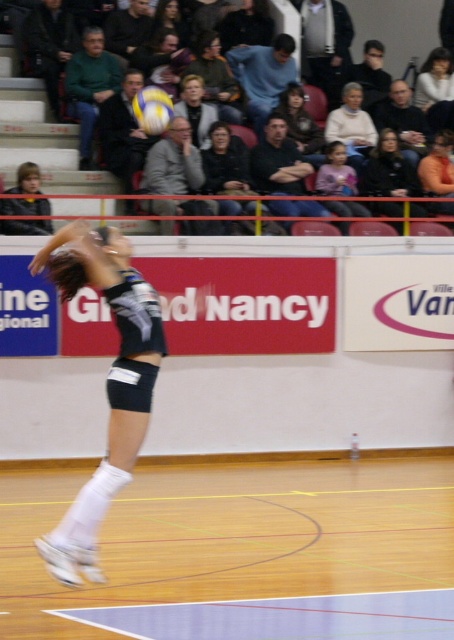
Question: Based on their relative distances, which object is nearer to the white matte volleyball at center?

Choices:
 (A) black jersey at upper center
 (B) smooth white blouse at upper center
 (C) orange fabric shirt at upper right

Answer: (A)

Question: Which object is the closest to the orange fabric shirt at upper right?

Choices:
 (A) wooden floor at center
 (B) smooth white blouse at upper center

Answer: (B)

Question: Does pink fabric shirt at center come behind smooth white blouse at upper center?

Choices:
 (A) yes
 (B) no

Answer: (B)

Question: Which point is closer to the camera?

Choices:
 (A) (343, 497)
 (B) (350, 177)
 (C) (144, 92)

Answer: (C)

Question: Does dark brown hair at upper center appear on the left side of matte black shorts at center?

Choices:
 (A) no
 (B) yes

Answer: (A)

Question: Observing the image, what is the correct spatial positioning of black jersey at upper center in reference to dark brown hair at upper center?

Choices:
 (A) above
 (B) below

Answer: (B)